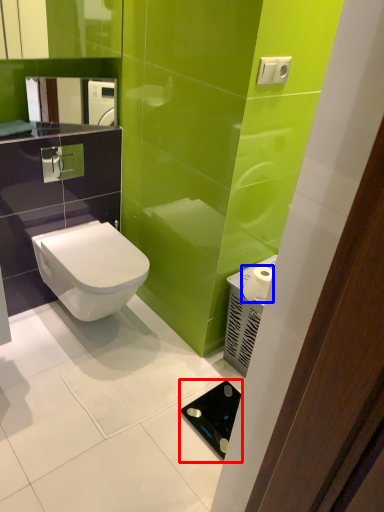
Question: Among these objects, which one is nearest to the camera, appliance (highlighted by a red box) or toilet paper (highlighted by a blue box)?

Choices:
 (A) appliance
 (B) toilet paper

Answer: (A)